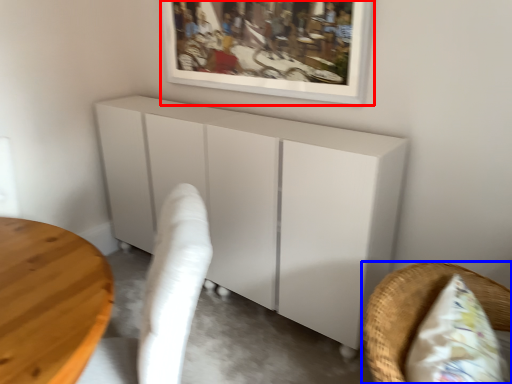
Question: Which object is further to the camera taking this photo, picture frame (highlighted by a red box) or furniture (highlighted by a blue box)?

Choices:
 (A) picture frame
 (B) furniture

Answer: (A)